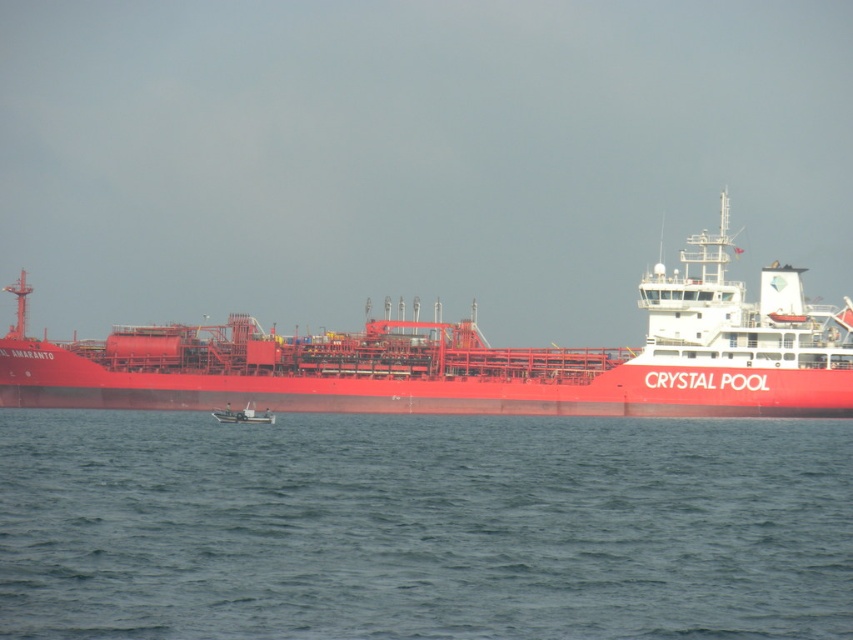
You are a port authority official inspecting the harbor. You notice the metallic red ship at center and the metallic gray boat at center. Which one should you prioritize for docking based on their sizes?

The metallic red ship at center has a larger size compared to the metallic gray boat at center, so you should prioritize the metallic red ship at center for docking first to accommodate its size.

You are a marine biologist observing the CRYSTAL POOL cargo ship from a small boat. You notice the blue water at lower center and the metallic red ship at center. Which object takes up more space in the image?

The metallic red ship at center takes up more space in the image because the blue water at lower center has a smaller size compared to it.